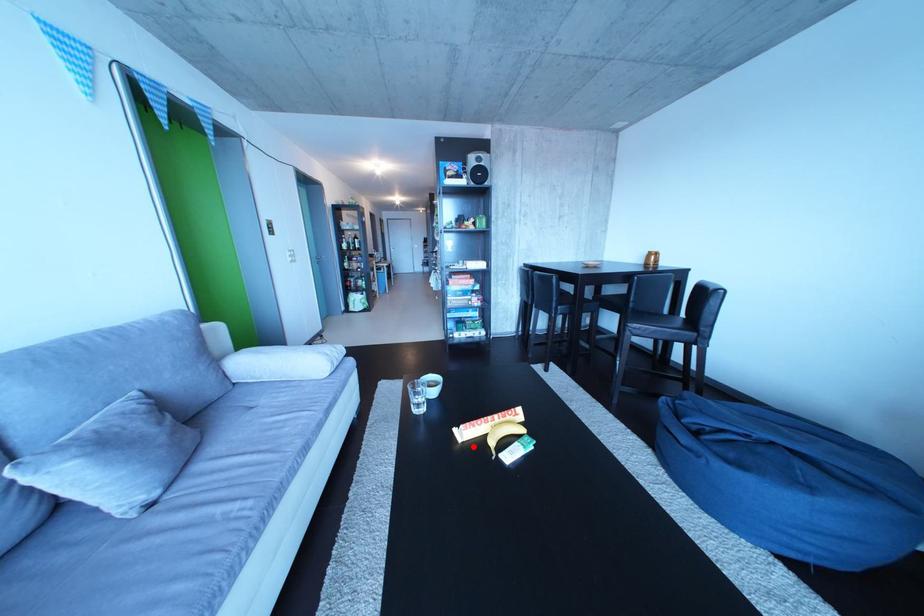
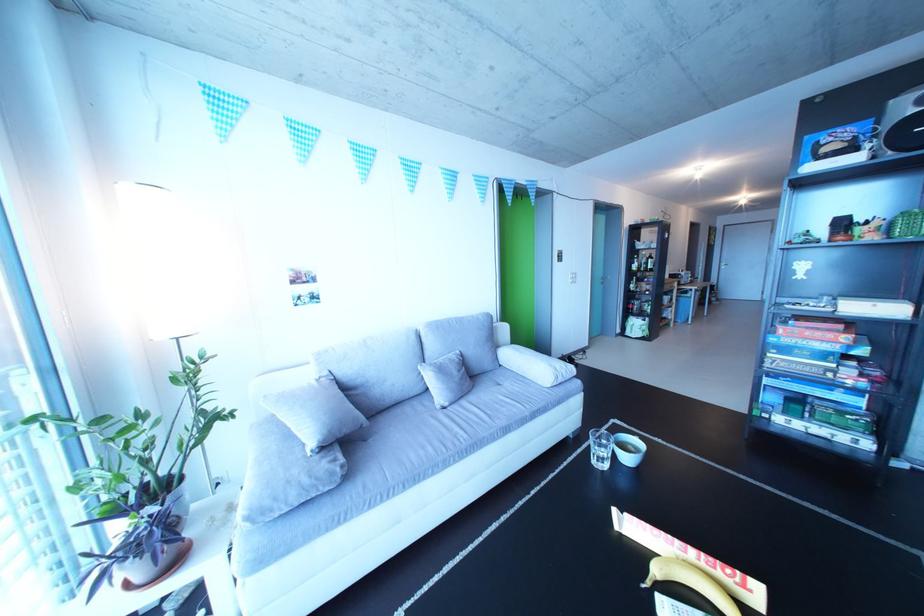
In the second image, find the point that corresponds to the highlighted location in the first image.

(630, 533)